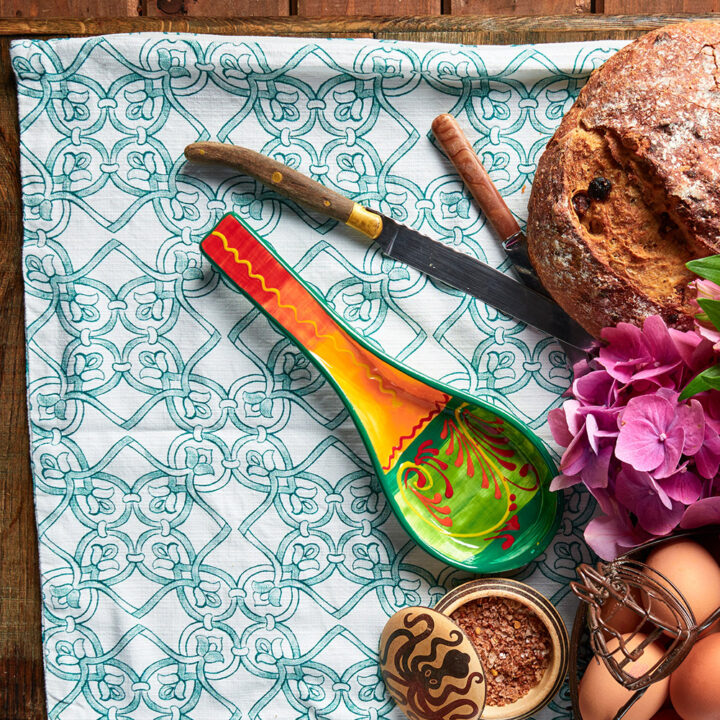
Where is `wood countertop`? The height and width of the screenshot is (720, 720). wood countertop is located at coordinates (12, 448).